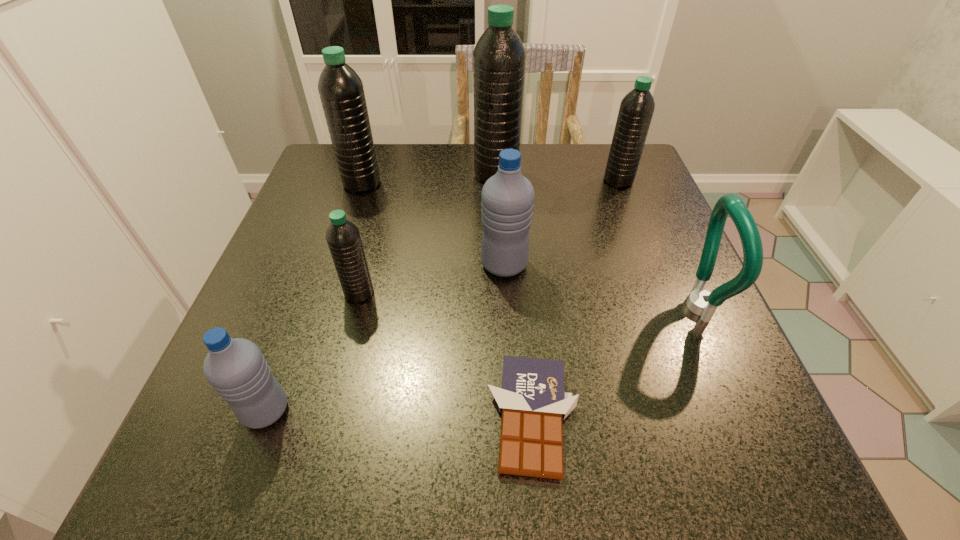
Identify which black water bottle is the nearest to the tallest water bottle. Please provide its 2D coordinates. Your answer should be formatted as a tuple, i.e. [(x, y)], where the tuple contains the x and y coordinates of a point satisfying the conditions above.

[(636, 109)]

The image size is (960, 540). I want to click on free location that satisfies the following two spatial constraints: 1. on the back side of the rightmost black water bottle; 2. on the left side of the smallest black water bottle, so click(x=388, y=181).

Image resolution: width=960 pixels, height=540 pixels. Find the location of `free space in the image that satisfies the following two spatial constraints: 1. on the back side of the smallest black water bottle; 2. on the left side of the tallest object`. free space in the image that satisfies the following two spatial constraints: 1. on the back side of the smallest black water bottle; 2. on the left side of the tallest object is located at coordinates (390, 174).